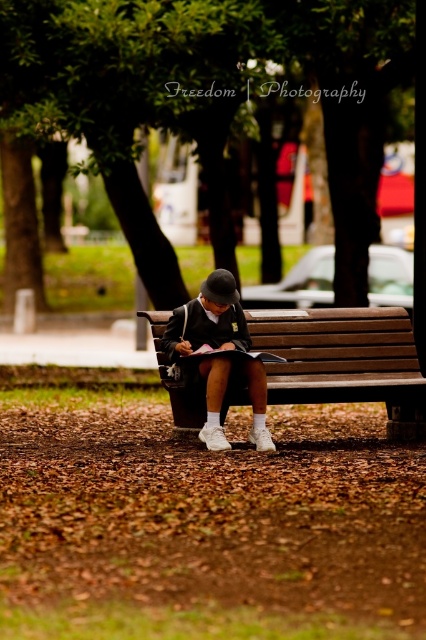
You are standing in the park and want to sit on the brown wooden bench at center. There is a person wearing a white matte uniform at center already sitting there. Can you sit on the bench without moving them?

The brown wooden bench at center is to the right of the white matte uniform at center, so there might be space on the right side of the bench where the person is not sitting. You can sit there without disturbing them.

You are standing at the point where the person is sitting on the wooden bench. You want to throw a small ball to a friend who is standing 10 meters away from you in the direction of the parked cars. Is the point at coordinates point (408, 396) within the area where the ball could land?

The distance of point (408, 396) from viewer is 8.55 meters, so yes, the ball could land at that point since it is within the 10 meters range.